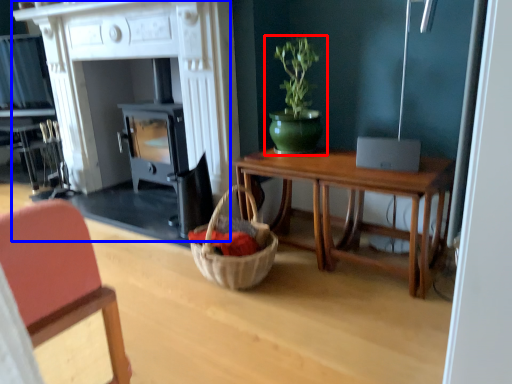
Question: Which point is further to the camera, houseplant (highlighted by a red box) or fireplace (highlighted by a blue box)?

Choices:
 (A) houseplant
 (B) fireplace

Answer: (A)